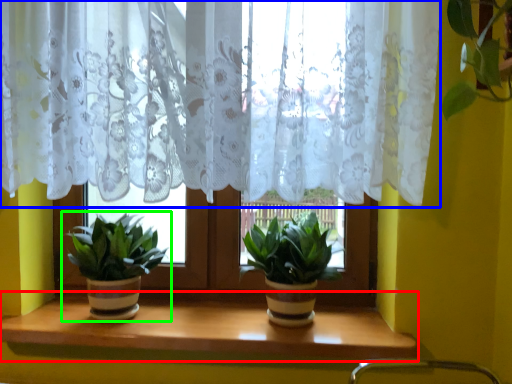
Question: Which is nearer to the window sill (highlighted by a red box)? curtain (highlighted by a blue box) or houseplant (highlighted by a green box).

Choices:
 (A) curtain
 (B) houseplant

Answer: (B)